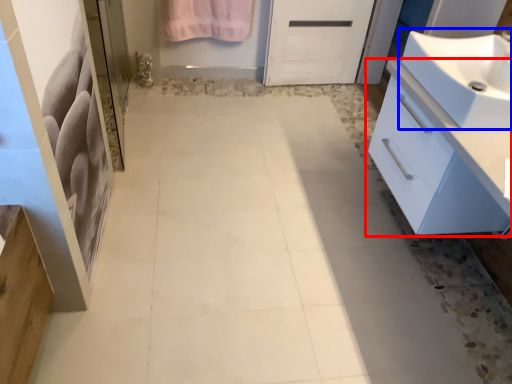
Question: Which object is further to the camera taking this photo, bathroom cabinet (highlighted by a red box) or sink (highlighted by a blue box)?

Choices:
 (A) bathroom cabinet
 (B) sink

Answer: (B)